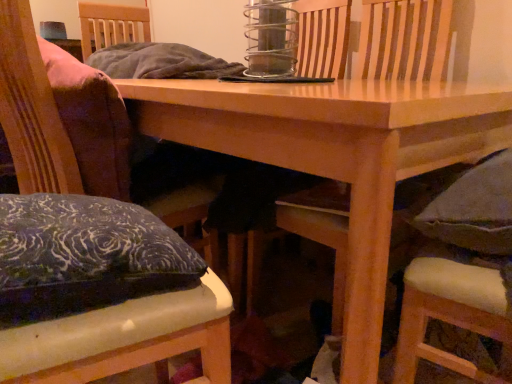
Question: In the image, is velvet cushion at left, which appears as the 1th chair when viewed from the left, on the left side or the right side of dark gray cushioned chair at lower right, positioned as the 3th chair in left-to-right order?

Choices:
 (A) left
 (B) right

Answer: (A)

Question: Would you say velvet cushion at left, which appears as the third chair when viewed from the right, is inside or outside dark gray cushioned chair at lower right, positioned as the 3th chair in left-to-right order?

Choices:
 (A) inside
 (B) outside

Answer: (B)

Question: Which of these objects is positioned farthest from the velvet cushion at left, which appears as the third chair when viewed from the right?

Choices:
 (A) wooden table at center
 (B) dark gray cushioned chair at lower right, positioned as the 3th chair in left-to-right order
 (C) velvet cushioned armchair at center
 (D) velvet cushion at left, which is counted as the second chair, starting from the left

Answer: (C)

Question: Based on their relative distances, which object is farther from the dark gray cushioned chair at lower right, positioned as the 3th chair in left-to-right order?

Choices:
 (A) wooden table at center
 (B) velvet cushion at left, which appears as the 1th chair when viewed from the left
 (C) velvet cushion at left, the 2th chair positioned from the right
 (D) velvet cushioned armchair at center

Answer: (D)